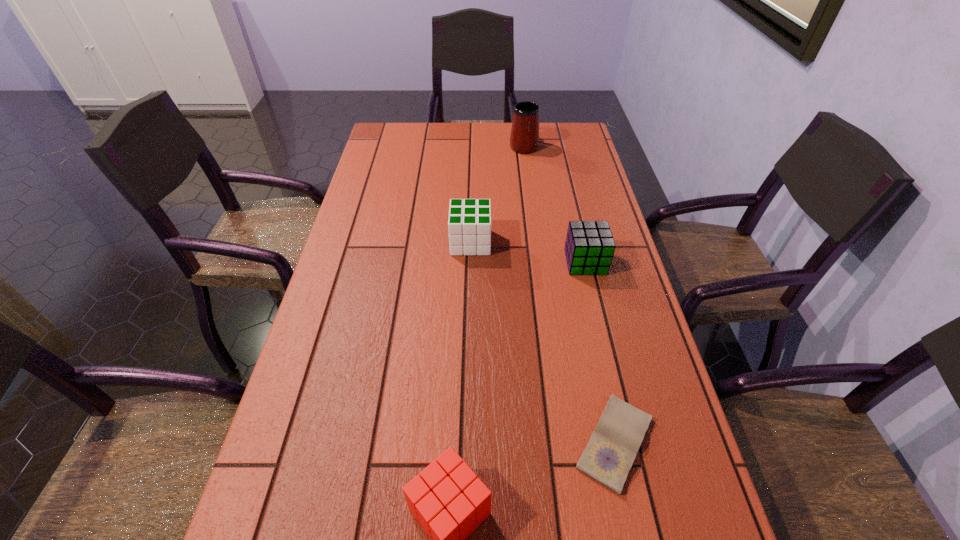
Identify the location of diary that is at the right edge. (608, 457).

Locate an element on the screen. free region at the far edge of the desktop is located at coordinates tap(474, 141).

At what (x,y) coordinates should I click in order to perform the action: click on vacant space at the left edge of the desktop. Please return your answer as a coordinate pair (x, y). The width and height of the screenshot is (960, 540). Looking at the image, I should click on (403, 161).

Image resolution: width=960 pixels, height=540 pixels. In order to click on free spot at the right edge of the desktop in this screenshot , I will do `click(592, 168)`.

Identify the location of vacant space at the far left corner of the desktop. (402, 142).

The width and height of the screenshot is (960, 540). I want to click on empty space between the mug and the rightmost cube, so click(x=555, y=204).

The height and width of the screenshot is (540, 960). Identify the location of free point between the shortest object and the rightmost cube. (600, 353).

Identify the location of vacant point located between the rightmost cube and the farthest object. (x=555, y=204).

Locate an element on the screen. vacant space that is in between the farthest object and the shortest object is located at coordinates (569, 294).

Identify the location of object that is the fourth nearest to the shortest object. The image size is (960, 540). (524, 138).